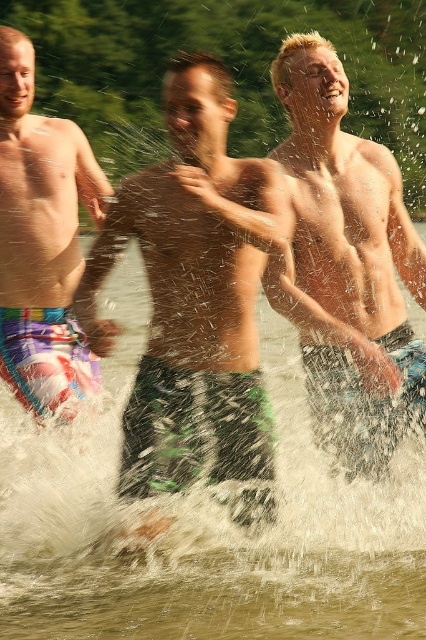
Question: Does smooth skin torso at center have a smaller size compared to multicolored swim trunks at left?

Choices:
 (A) no
 (B) yes

Answer: (B)

Question: Can you confirm if green textured shorts at center is positioned below smooth skin torso at center?

Choices:
 (A) no
 (B) yes

Answer: (B)

Question: Which object is the farthest from the smooth skin torso at center?

Choices:
 (A) green textured shorts at center
 (B) multicolored swim trunks at left

Answer: (B)

Question: Which object is positioned farthest from the smooth skin torso at center?

Choices:
 (A) green textured shorts at center
 (B) multicolored swim trunks at left

Answer: (B)

Question: Among these points, which one is nearest to the camera?

Choices:
 (A) (328, 80)
 (B) (150, 364)
 (C) (36, 128)

Answer: (B)

Question: Where is smooth skin torso at center located in relation to multicolored swim trunks at left in the image?

Choices:
 (A) above
 (B) below

Answer: (B)